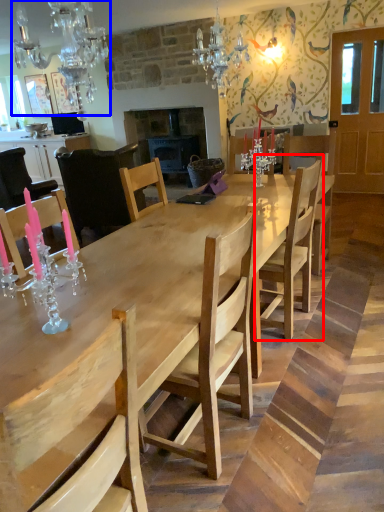
Question: Which point is further to the camera, chair (highlighted by a red box) or light fixture (highlighted by a blue box)?

Choices:
 (A) chair
 (B) light fixture

Answer: (A)